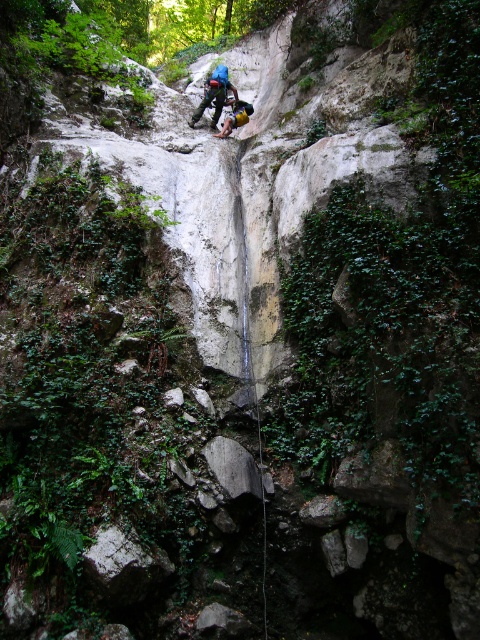
Question: Considering the relative positions of blue fabric backpack at center and blue fabric helmet at upper center in the image provided, where is blue fabric backpack at center located with respect to blue fabric helmet at upper center?

Choices:
 (A) above
 (B) below

Answer: (A)

Question: Is blue fabric backpack at center bigger than blue fabric helmet at upper center?

Choices:
 (A) yes
 (B) no

Answer: (A)

Question: Is blue fabric backpack at center in front of blue fabric helmet at upper center?

Choices:
 (A) yes
 (B) no

Answer: (B)

Question: Which point appears farthest from the camera in this image?

Choices:
 (A) (233, 92)
 (B) (229, 125)

Answer: (A)